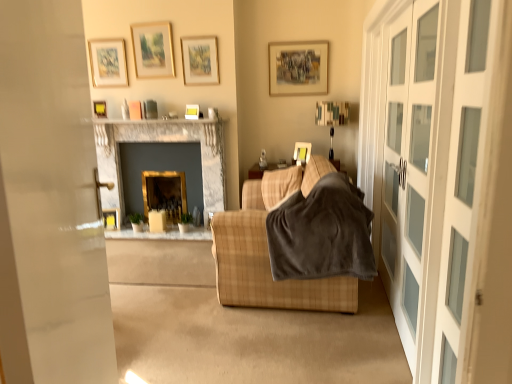
What are the coordinates of `free space above matte brown picture frame at upper center, the second picture frame in the right-to-left sequence (from a real-world perspective)` in the screenshot? It's located at (301, 36).